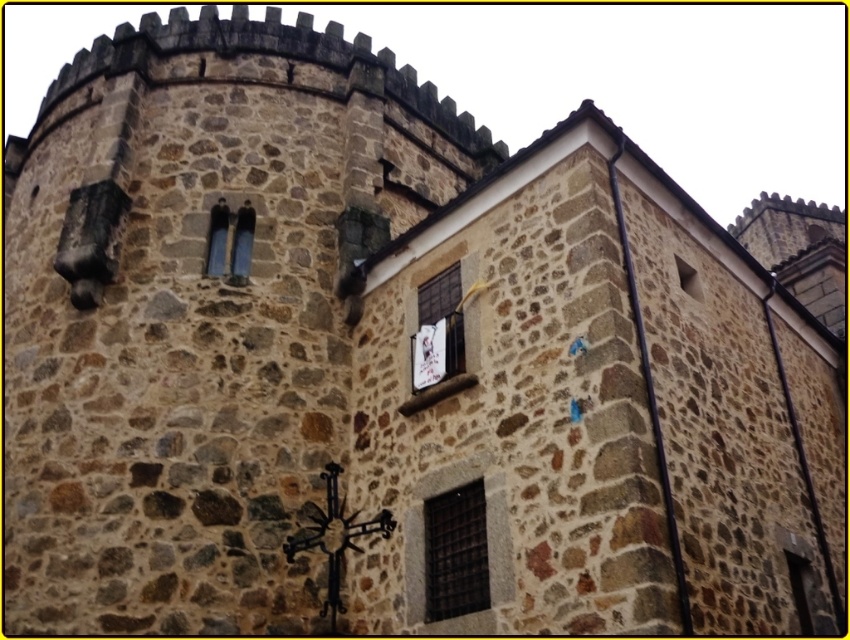
Question: Is dark gray metal grid at center wider than dark glass window at center left?

Choices:
 (A) no
 (B) yes

Answer: (B)

Question: Which point appears farthest from the camera in this image?

Choices:
 (A) (697, 298)
 (B) (451, 572)
 (C) (213, 243)
 (D) (432, 380)

Answer: (C)

Question: Which point is farther to the camera?

Choices:
 (A) dark glass window at center left
 (B) dark gray metal grid at center
 (C) black wrought iron cross at center

Answer: (A)

Question: Is black wrought iron cross at center below dark glass window at center left?

Choices:
 (A) yes
 (B) no

Answer: (A)

Question: Estimate the real-world distances between objects in this image. Which object is closer to the dark gray metal grid at center?

Choices:
 (A) black wrought iron cross at center
 (B) clear glass window at upper right

Answer: (A)

Question: Does dark gray metal grid at center have a greater width compared to clear glass window at upper right?

Choices:
 (A) yes
 (B) no

Answer: (A)